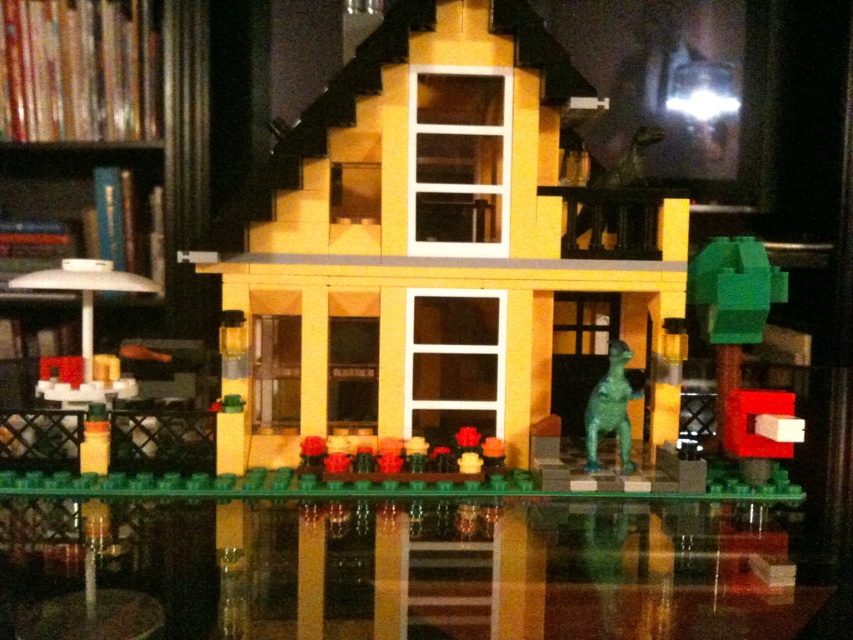
You are a visitor standing in front of the LEGO scene. You see the yellow matte house at center and the green metallic dinosaur at center. Which object is positioned to the east?

The yellow matte house at center is to the left of the green metallic dinosaur at center, so the yellow matte house at center is positioned to the east.

You are a delivery robot with a package that needs to be placed on the transparent glass table at lower center. The robot has a maximum reach of 25 inches. Can you place the package directly from your current position without moving closer?

The distance between the robot and the transparent glass table at lower center is 26.24 inches, which exceeds the robot maximum reach of 25 inches. Therefore, the robot cannot place the package directly without moving closer.

You are standing at the point with coordinates point (598, 428) and want to walk towards the house. Is the point (413, 353) located behind the house relative to your position?

Point (413, 353) is behind point (598, 428), so yes, it is located behind the house relative to your position at point (598, 428).